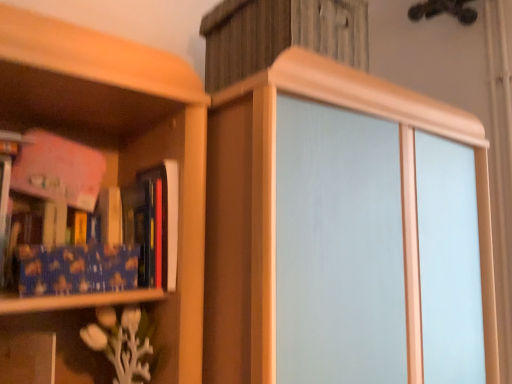
Question: Is hardcover book at left, positioned as the second book in left-to-right order, taller than blue textured fabric book at left, the 2th book viewed from the right?

Choices:
 (A) yes
 (B) no

Answer: (B)

Question: From a real-world perspective, does hardcover book at left, positioned as the second book in left-to-right order, sit lower than blue textured fabric book at left, the 2th book viewed from the right?

Choices:
 (A) no
 (B) yes

Answer: (B)

Question: Considering the relative sizes of hardcover book at left, arranged as the first book when viewed from the right, and blue textured fabric book at left, the 2th book viewed from the right, in the image provided, is hardcover book at left, arranged as the first book when viewed from the right, bigger than blue textured fabric book at left, the 2th book viewed from the right,?

Choices:
 (A) yes
 (B) no

Answer: (B)

Question: Does hardcover book at left, positioned as the second book in left-to-right order, lie behind blue textured fabric book at left, the 2th book viewed from the right?

Choices:
 (A) no
 (B) yes

Answer: (B)

Question: Does hardcover book at left, arranged as the first book when viewed from the right, have a greater width compared to blue textured fabric book at left, the 2th book viewed from the right?

Choices:
 (A) no
 (B) yes

Answer: (B)

Question: From a real-world perspective, is hardcover book at left, arranged as the first book when viewed from the right, on blue textured fabric book at left, arranged as the 1th book when viewed from the left?

Choices:
 (A) no
 (B) yes

Answer: (A)

Question: Is blue textured paper at left turned away from blue textured fabric book at left, the 2th book viewed from the right?

Choices:
 (A) yes
 (B) no

Answer: (A)

Question: From the image's perspective, is blue textured paper at left beneath blue textured fabric book at left, the 2th book viewed from the right?

Choices:
 (A) yes
 (B) no

Answer: (A)

Question: Is blue textured paper at left with blue textured fabric book at left, arranged as the 1th book when viewed from the left?

Choices:
 (A) no
 (B) yes

Answer: (B)

Question: Would you consider blue textured paper at left to be distant from blue textured fabric book at left, arranged as the 1th book when viewed from the left?

Choices:
 (A) yes
 (B) no

Answer: (B)

Question: Is blue textured paper at left smaller than blue textured fabric book at left, the 2th book viewed from the right?

Choices:
 (A) yes
 (B) no

Answer: (A)

Question: Is blue textured paper at left completely or partially outside of blue textured fabric book at left, the 2th book viewed from the right?

Choices:
 (A) no
 (B) yes

Answer: (B)

Question: Is hardcover book at left, positioned as the second book in left-to-right order, surrounded by blue textured fabric book at left, arranged as the 1th book when viewed from the left?

Choices:
 (A) yes
 (B) no

Answer: (B)